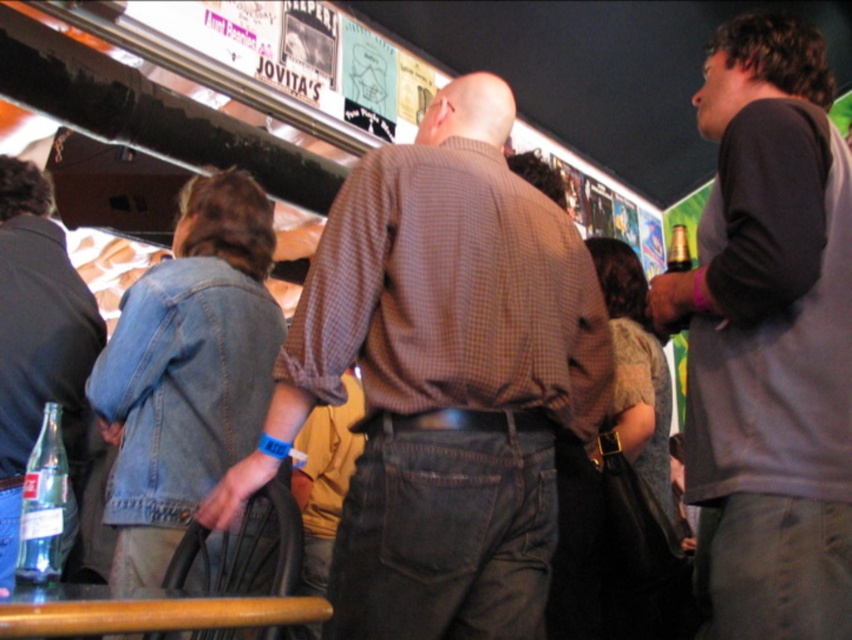
Between point (763, 202) and point (43, 451), which one is positioned in front?

Point (763, 202) is in front.

Is point (827, 412) less distant than point (44, 429)?

Yes, it is.

Locate an element on the screen. gray sweatshirt at upper right is located at coordinates (770, 337).

Can you confirm if brown checkered shirt at center is positioned to the right of denim jacket at lower left?

Correct, you'll find brown checkered shirt at center to the right of denim jacket at lower left.

Is brown checkered shirt at center above denim jacket at lower left?

Yes, brown checkered shirt at center is above denim jacket at lower left.

Between point (603, 403) and point (32, 314), which one is positioned behind?

The point (32, 314) is behind.

Where is `brown checkered shirt at center`? brown checkered shirt at center is located at coordinates (442, 378).

Is brown checkered shirt at center further to camera compared to gray sweatshirt at upper right?

Yes, brown checkered shirt at center is behind gray sweatshirt at upper right.

Is point (492, 572) positioned before point (826, 529)?

No, (492, 572) is behind (826, 529).

The height and width of the screenshot is (640, 852). What do you see at coordinates (442, 378) in the screenshot?
I see `brown checkered shirt at center` at bounding box center [442, 378].

The image size is (852, 640). What are the coordinates of `brown checkered shirt at center` in the screenshot? It's located at (442, 378).